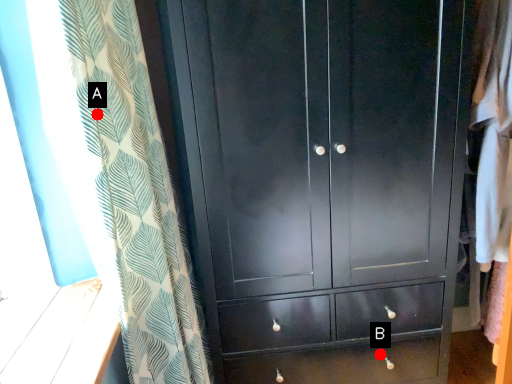
Question: Two points are circled on the image, labeled by A and B beside each circle. Which point appears farthest from the camera in this image?

Choices:
 (A) A is further
 (B) B is further

Answer: (B)